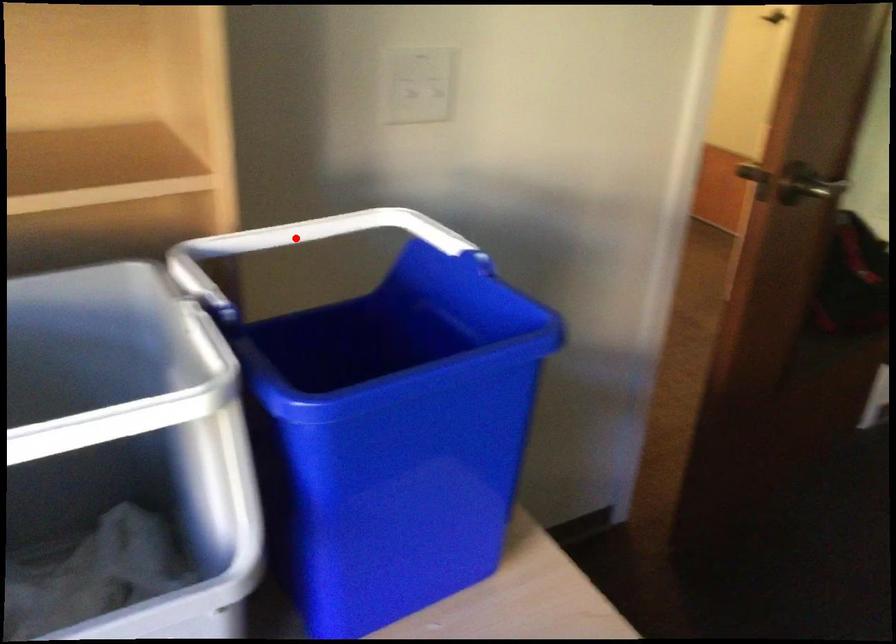
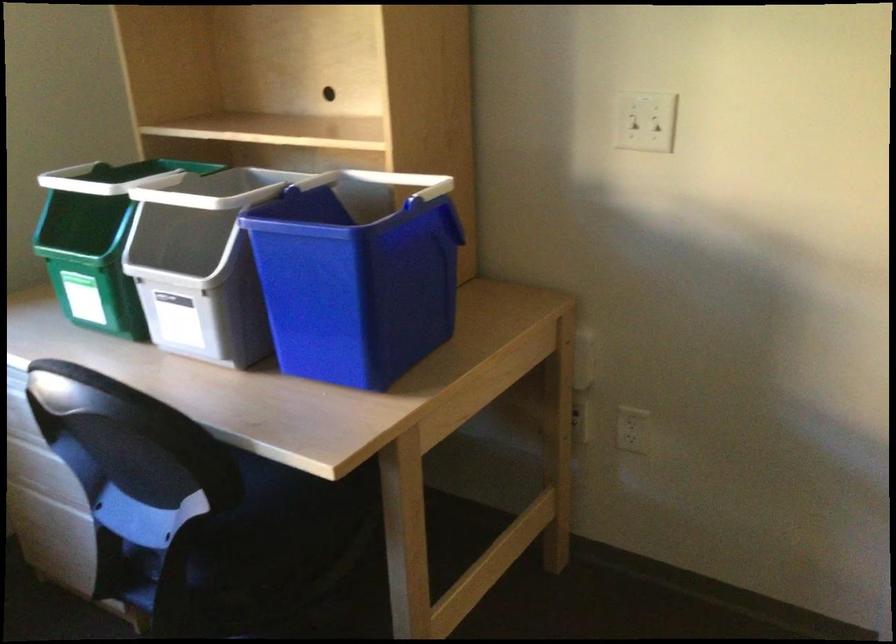
Locate, in the second image, the point that corresponds to the highlighted location in the first image.

(399, 181)